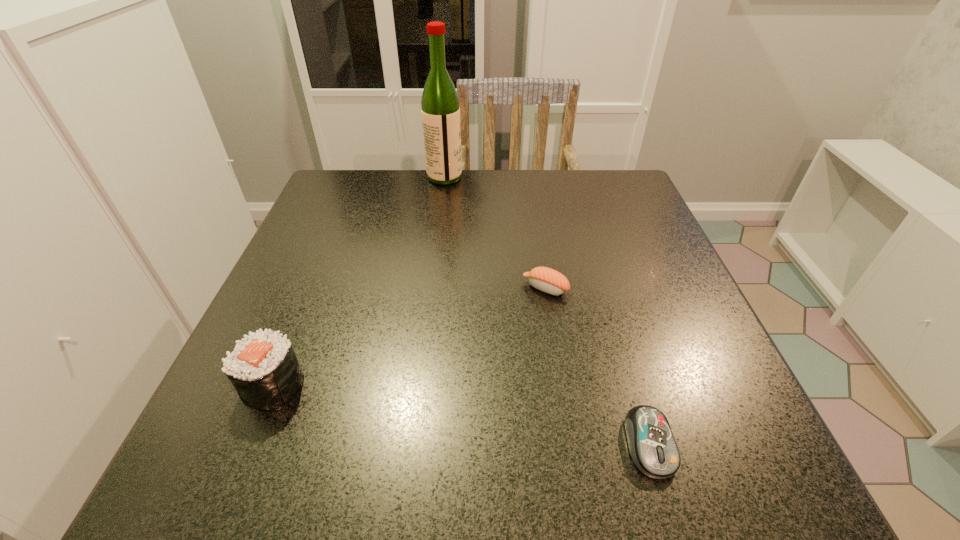
This screenshot has height=540, width=960. Identify the location of free space between the third object from right to left and the left sushi. (359, 281).

The width and height of the screenshot is (960, 540). What are the coordinates of `the closest object to the computer mouse` in the screenshot? It's located at (545, 279).

You are a GUI agent. You are given a task and a screenshot of the screen. Output one action in this format:
    pyautogui.click(x=<x>, y=<y>)
    Task: Click on the second closest object to the right sushi
    Image resolution: width=960 pixels, height=540 pixels.
    Given the screenshot: What is the action you would take?
    pyautogui.click(x=440, y=111)

Locate an element on the screen. Image resolution: width=960 pixels, height=540 pixels. free location that satisfies the following two spatial constraints: 1. on the back side of the third object from left to right; 2. on the label of the tallest object is located at coordinates (528, 177).

Locate an element on the screen. This screenshot has height=540, width=960. blank area in the image that satisfies the following two spatial constraints: 1. on the label of the second object from right to left; 2. on the left side of the second object from left to right is located at coordinates (431, 288).

Locate an element on the screen. This screenshot has height=540, width=960. vacant space that satisfies the following two spatial constraints: 1. on the label of the farthest object; 2. on the back side of the shorter sushi is located at coordinates (431, 288).